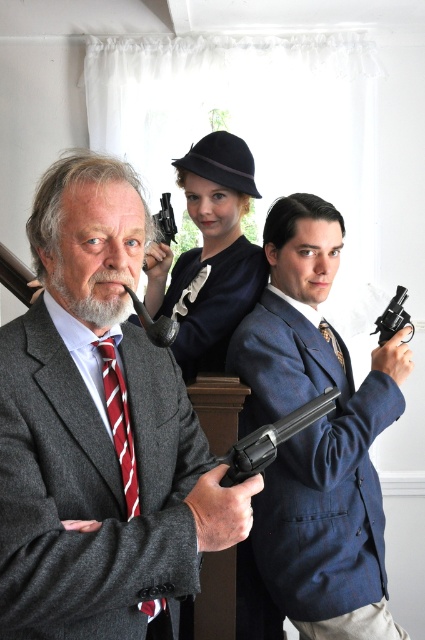
Question: Considering the relative positions of matte gray suit at center and black metal revolver at right in the image provided, where is matte gray suit at center located with respect to black metal revolver at right?

Choices:
 (A) right
 (B) left

Answer: (B)

Question: Does matte gray suit at center have a smaller size compared to black matte revolver at center?

Choices:
 (A) no
 (B) yes

Answer: (A)

Question: Which point appears closest to the camera in this image?

Choices:
 (A) (320, 404)
 (B) (323, 330)

Answer: (A)

Question: Can you confirm if matte gray suit at center is positioned below black metal revolver at right?

Choices:
 (A) yes
 (B) no

Answer: (A)

Question: Which point is farther to the camera?

Choices:
 (A) matte gray suit at center
 (B) black metal revolver at right

Answer: (B)

Question: Among these points, which one is nearest to the camera?

Choices:
 (A) (374, 630)
 (B) (269, 440)
 (C) (328, 337)
 (D) (107, 348)

Answer: (B)